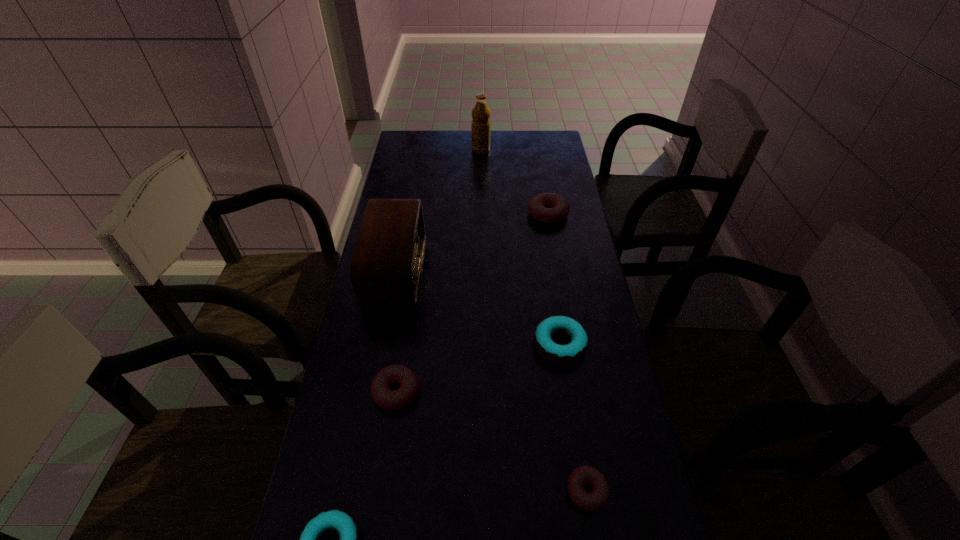
The image size is (960, 540). Find the location of `free spot that satisfies the following two spatial constraints: 1. on the front label of the fourth object from left to right; 2. on the back side of the sixth nearest object`. free spot that satisfies the following two spatial constraints: 1. on the front label of the fourth object from left to right; 2. on the back side of the sixth nearest object is located at coordinates (481, 214).